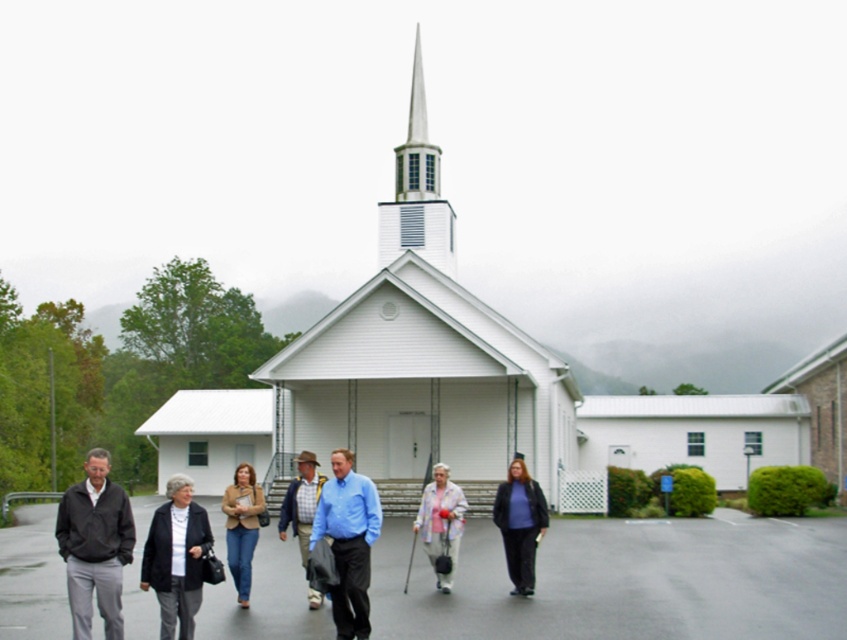
Does point (147, 547) lie in front of point (516, 566)?

Yes.

Describe the element at coordinates (176, 557) in the screenshot. This screenshot has width=847, height=640. I see `dark gray fabric jacket at lower left` at that location.

Where is `dark gray fabric jacket at lower left`? This screenshot has height=640, width=847. dark gray fabric jacket at lower left is located at coordinates (176, 557).

Is dark gray fabric jacket at lower left to the right of plaid shirt at center from the viewer's perspective?

In fact, dark gray fabric jacket at lower left is to the left of plaid shirt at center.

Does dark gray fabric jacket at lower left have a smaller size compared to plaid shirt at center?

Indeed, dark gray fabric jacket at lower left has a smaller size compared to plaid shirt at center.

Which is in front, point (158, 528) or point (316, 600)?

Positioned in front is point (158, 528).

This screenshot has height=640, width=847. What are the coordinates of `dark gray fabric jacket at lower left` in the screenshot? It's located at (176, 557).

Does white wooden church at center have a larger size compared to blue shirt at center?

Yes, white wooden church at center is bigger than blue shirt at center.

This screenshot has width=847, height=640. In order to click on white wooden church at center in this screenshot , I will do `click(451, 385)`.

Locate an element on the screen. The image size is (847, 640). white wooden church at center is located at coordinates (451, 385).